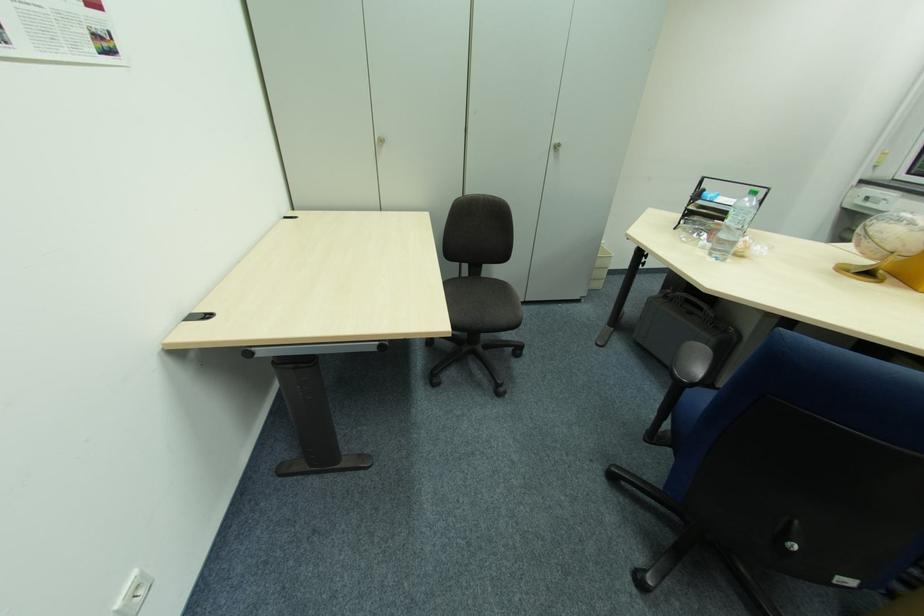
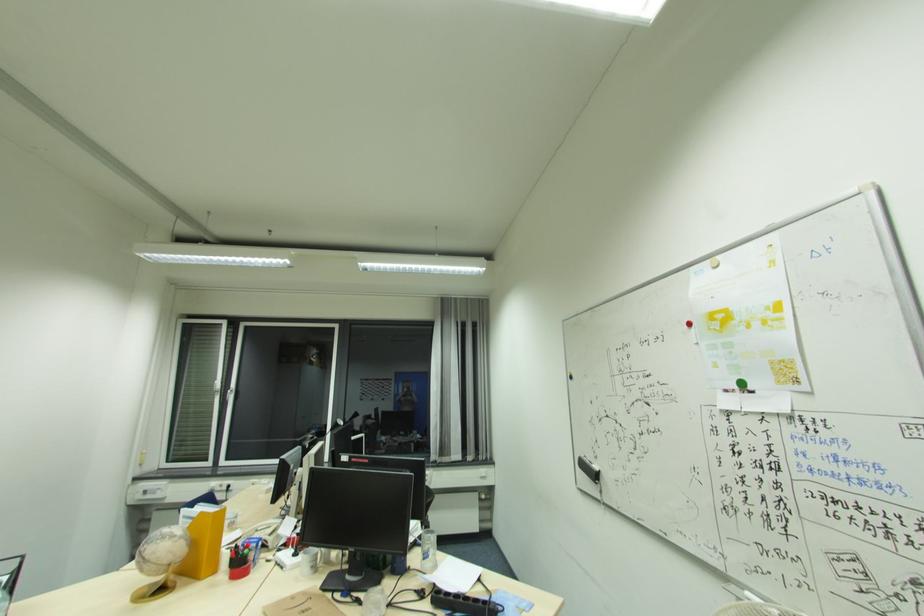
The point at (893, 249) is marked in the first image. Where is the corresponding point in the second image?

(167, 564)